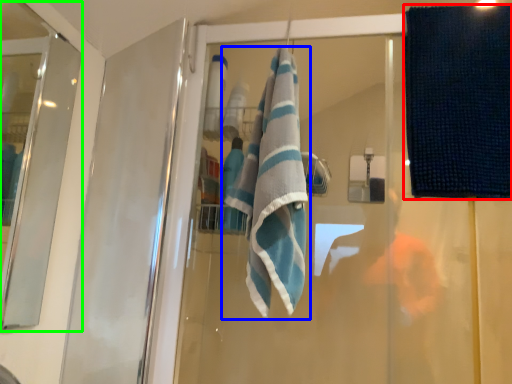
Question: Based on their relative distances, which object is nearer to beach towel (highlighted by a red box)? Choose from towel (highlighted by a blue box) and screen door (highlighted by a green box).

Choices:
 (A) towel
 (B) screen door

Answer: (A)